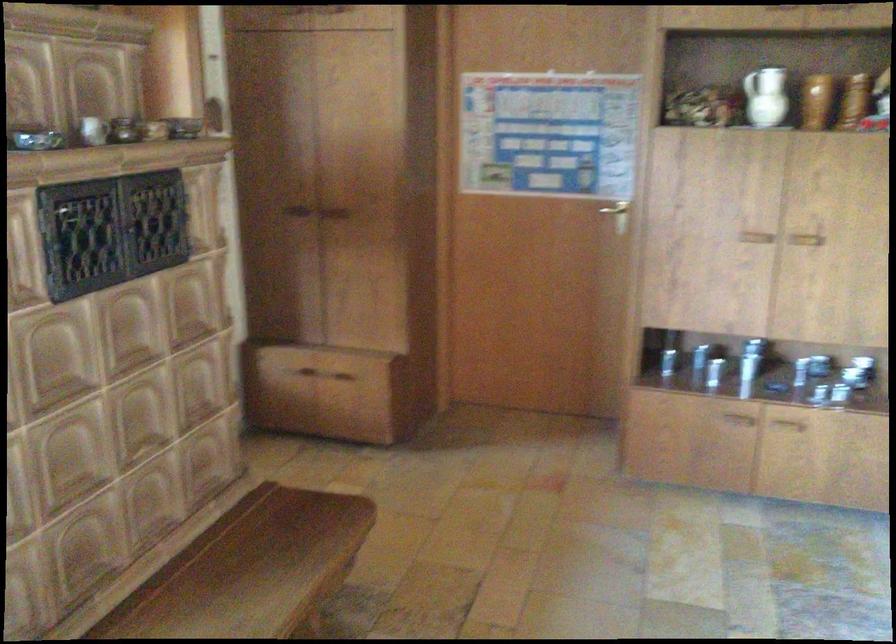
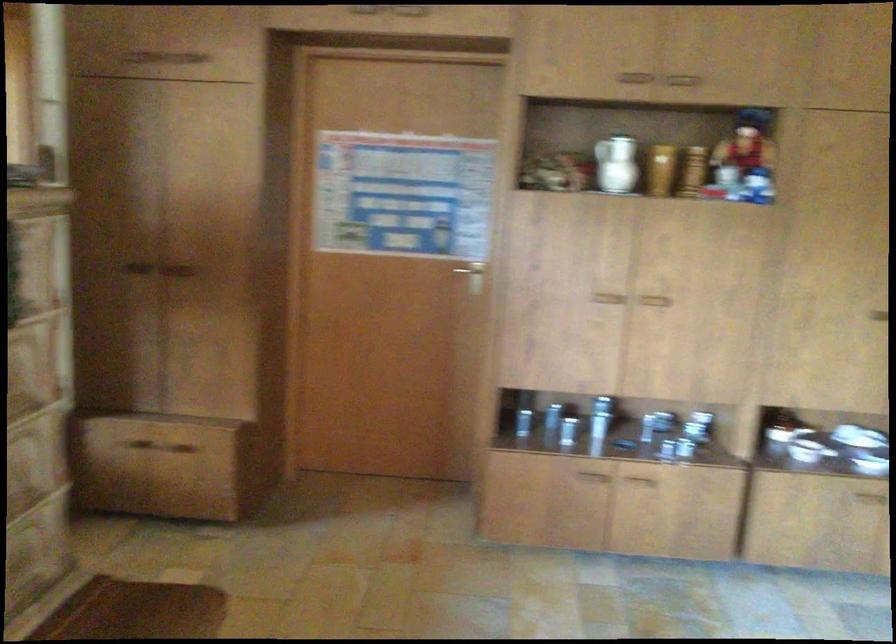
The point at (713, 370) is marked in the first image. Where is the corresponding point in the second image?

(572, 431)